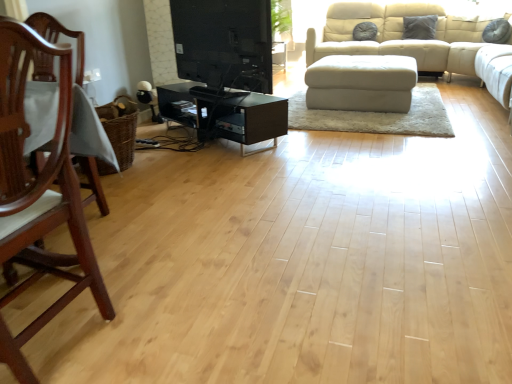
Question: Is white fabric ottoman at center located within mahogany wood chair at left?

Choices:
 (A) no
 (B) yes

Answer: (A)

Question: Is mahogany wood chair at left completely or partially outside of white fabric ottoman at center?

Choices:
 (A) no
 (B) yes

Answer: (B)

Question: Can you confirm if mahogany wood chair at left is shorter than white fabric ottoman at center?

Choices:
 (A) yes
 (B) no

Answer: (B)

Question: Is the surface of mahogany wood chair at left in direct contact with white fabric ottoman at center?

Choices:
 (A) no
 (B) yes

Answer: (A)

Question: From a real-world perspective, is mahogany wood chair at left beneath white fabric ottoman at center?

Choices:
 (A) yes
 (B) no

Answer: (B)

Question: In terms of size, does mahogany wood chair at left appear bigger or smaller than black glossy tv stand at center?

Choices:
 (A) big
 (B) small

Answer: (A)

Question: From a real-world perspective, is mahogany wood chair at left above or below black glossy tv stand at center?

Choices:
 (A) below
 (B) above

Answer: (A)

Question: In the image, is mahogany wood chair at left on the left side or the right side of black glossy tv stand at center?

Choices:
 (A) left
 (B) right

Answer: (A)

Question: Considering the positions of mahogany wood chair at left and black glossy tv stand at center in the image, is mahogany wood chair at left taller or shorter than black glossy tv stand at center?

Choices:
 (A) short
 (B) tall

Answer: (B)

Question: Is black glossy tv stand at center to the left or to the right of mahogany wood chair at left in the image?

Choices:
 (A) right
 (B) left

Answer: (A)

Question: In terms of height, does black glossy tv stand at center look taller or shorter compared to mahogany wood chair at left?

Choices:
 (A) short
 (B) tall

Answer: (A)

Question: Considering the positions of point (254, 51) and point (26, 286), is point (254, 51) closer or farther from the camera than point (26, 286)?

Choices:
 (A) farther
 (B) closer

Answer: (A)

Question: Which is correct: black glossy tv stand at center is inside mahogany wood chair at left, or outside of it?

Choices:
 (A) outside
 (B) inside

Answer: (A)

Question: From a real-world perspective, relative to black glass tv stand at center, is black glossy tv stand at center vertically above or below?

Choices:
 (A) below
 (B) above

Answer: (B)

Question: From the image's perspective, relative to black glass tv stand at center, is black glossy tv stand at center above or below?

Choices:
 (A) above
 (B) below

Answer: (A)